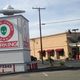
Find the location of `electrical wire`. electrical wire is located at coordinates (51, 23).